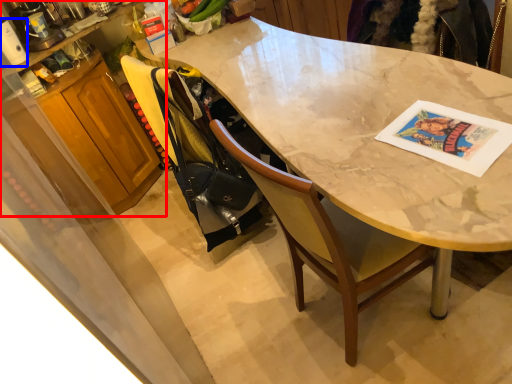
Question: Among these objects, which one is farthest to the camera, cabinetry (highlighted by a red box) or appliance (highlighted by a blue box)?

Choices:
 (A) cabinetry
 (B) appliance

Answer: (A)